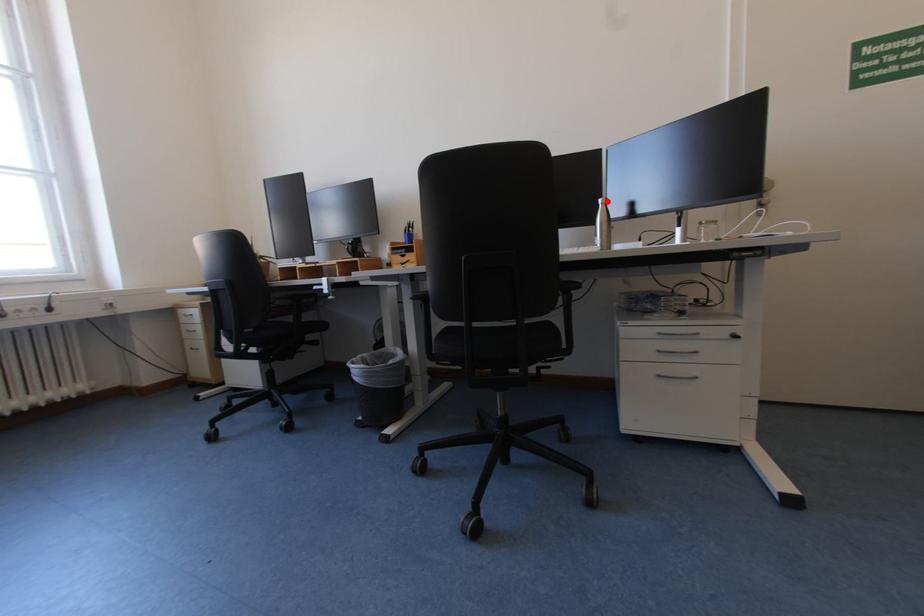
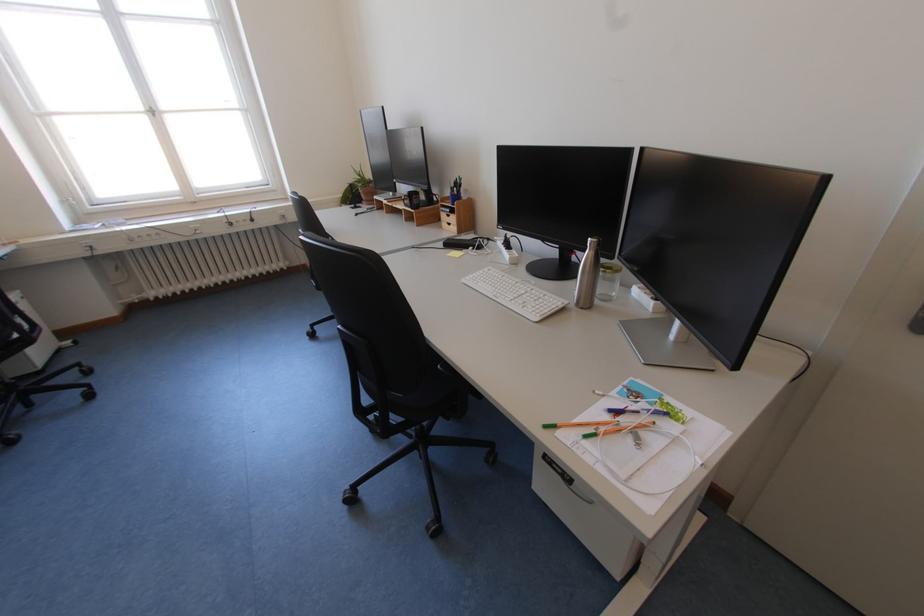
Find the pixel in the second image that matches the highlighted location in the first image.

(599, 240)